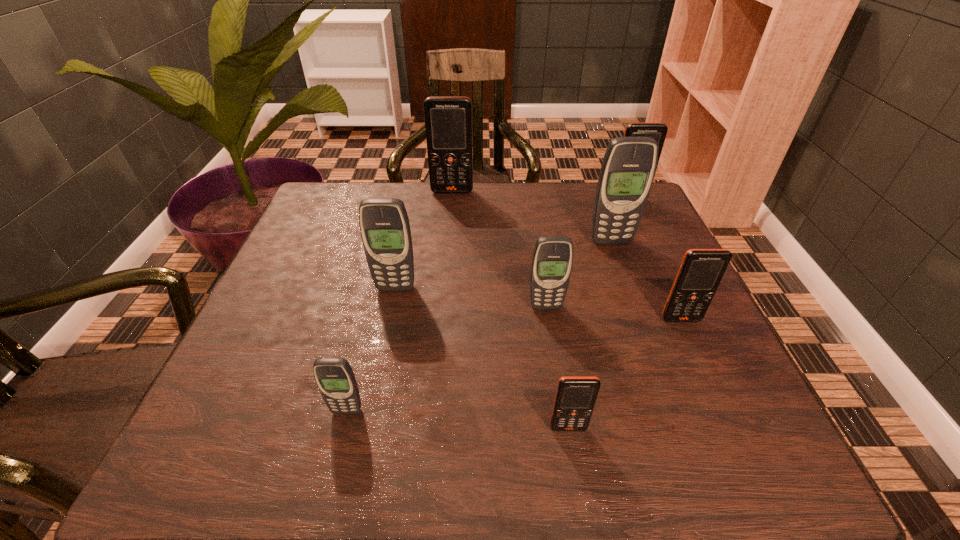
Identify the location of cellular telephone that is the third closest to the smallest gray cellular telephone. (552, 260).

Locate which orange cellular telephone is the second closest to the seventh nearest cellular telephone. Please provide its 2D coordinates. Your answer should be formatted as a tuple, i.e. [(x, y)], where the tuple contains the x and y coordinates of a point satisfying the conditions above.

[(701, 271)]

Identify the location of orange cellular telephone that can be found as the third closest to the nearest cellular telephone. This screenshot has height=540, width=960. (448, 120).

In order to click on the second closest gray cellular telephone to the farthest object in this screenshot , I will do `click(385, 230)`.

Find the location of `gray cellular telephone identified as the closest to the fourth nearest object`. gray cellular telephone identified as the closest to the fourth nearest object is located at coordinates (627, 172).